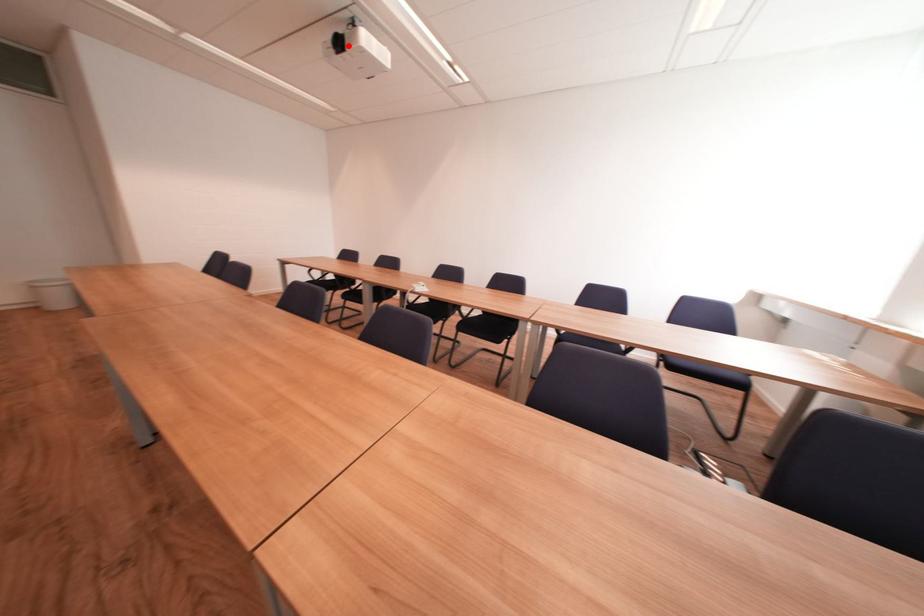
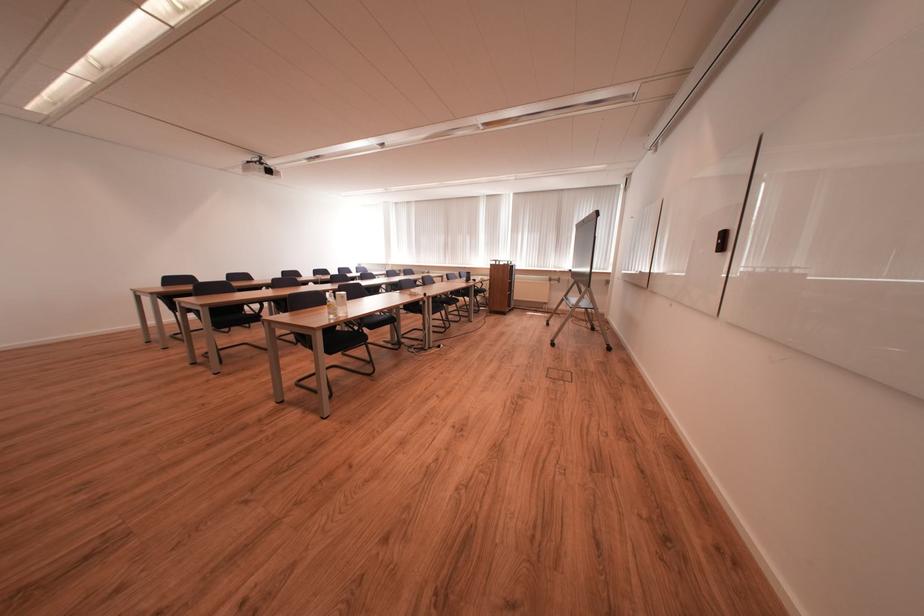
The point at the highlighted location is marked in the first image. Where is the corresponding point in the second image?

(277, 174)